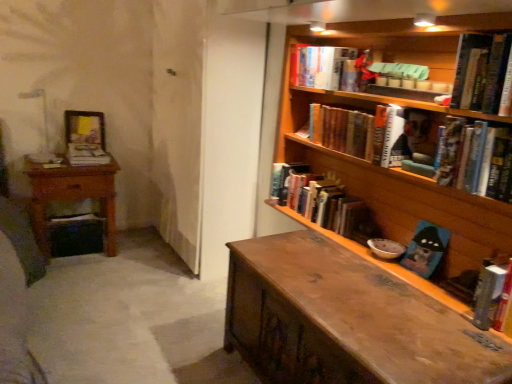
Question: Is hardcover book at center, the fifth book when ordered from right to left, completely or partially outside of hardcover book at right, arranged as the first book when viewed from the right?

Choices:
 (A) no
 (B) yes

Answer: (B)

Question: Is hardcover book at center, the fifth book when ordered from right to left, oriented away from hardcover book at right, arranged as the first book when viewed from the right?

Choices:
 (A) yes
 (B) no

Answer: (B)

Question: Is hardcover book at center, the fifth book when ordered from right to left, at the left side of hardcover book at right, arranged as the first book when viewed from the right?

Choices:
 (A) no
 (B) yes

Answer: (B)

Question: Is hardcover book at center, the 3th book positioned from the left, to the right of hardcover book at right, arranged as the first book when viewed from the right, from the viewer's perspective?

Choices:
 (A) yes
 (B) no

Answer: (B)

Question: Does hardcover book at center, the 3th book positioned from the left, have a greater height compared to hardcover book at right, marked as the seventh book in a left-to-right arrangement?

Choices:
 (A) no
 (B) yes

Answer: (A)

Question: From a real-world perspective, is hardcover book at center, the fifth book when ordered from right to left, below hardcover book at right, arranged as the first book when viewed from the right?

Choices:
 (A) yes
 (B) no

Answer: (A)

Question: Is hardcover book at upper right, the 3th book positioned from the right, oriented towards hardcover book at center, the 3th book positioned from the left?

Choices:
 (A) yes
 (B) no

Answer: (B)

Question: Is hardcover book at upper right, the 3th book positioned from the right, completely or partially outside of hardcover book at center, the fifth book when ordered from right to left?

Choices:
 (A) yes
 (B) no

Answer: (A)

Question: From the image's perspective, is hardcover book at upper right, the 3th book positioned from the right, located beneath hardcover book at center, the fifth book when ordered from right to left?

Choices:
 (A) yes
 (B) no

Answer: (B)

Question: Is hardcover book at upper right, the 5th book positioned from the left, not near hardcover book at center, the 3th book positioned from the left?

Choices:
 (A) yes
 (B) no

Answer: (B)

Question: Is hardcover book at upper right, the 3th book positioned from the right, at the right side of hardcover book at center, the 3th book positioned from the left?

Choices:
 (A) no
 (B) yes

Answer: (B)

Question: Can you confirm if hardcover book at upper right, the 3th book positioned from the right, is shorter than hardcover book at center, the fifth book when ordered from right to left?

Choices:
 (A) no
 (B) yes

Answer: (B)

Question: Is wooden bookshelf at upper right smaller than hardcover book at right, marked as the seventh book in a left-to-right arrangement?

Choices:
 (A) no
 (B) yes

Answer: (A)